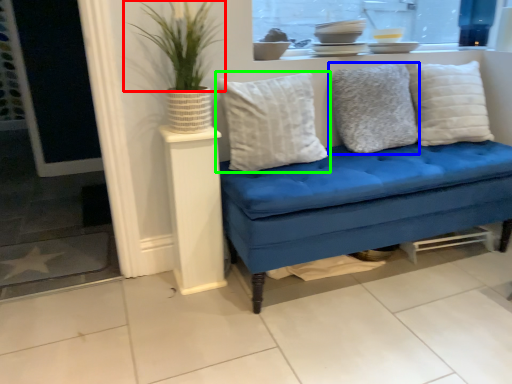
Question: Estimate the real-world distances between objects in this image. Which object is farther from plant (highlighted by a red box), pillow (highlighted by a blue box) or pillow (highlighted by a green box)?

Choices:
 (A) pillow
 (B) pillow

Answer: (A)